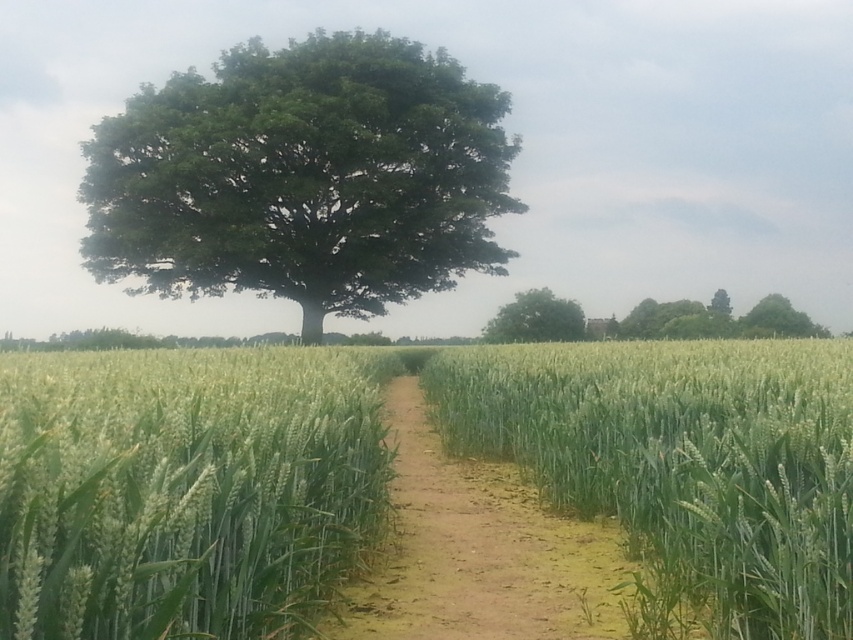
Question: Does green matte wheat at center appear over green leafy tree at center?

Choices:
 (A) yes
 (B) no

Answer: (B)

Question: Considering the real-world distances, which object is farthest from the green leafy tree at center?

Choices:
 (A) green leafy oak tree at center
 (B) green matte wheat at center

Answer: (B)

Question: Which point appears closest to the camera in this image?

Choices:
 (A) (498, 310)
 (B) (426, 426)
 (C) (296, 289)
 (D) (302, 483)

Answer: (D)

Question: Can you confirm if green matte wheat at center is positioned to the left of dull brown dirt path at center?

Choices:
 (A) yes
 (B) no

Answer: (A)

Question: Can you confirm if green matte wheat at center is positioned to the right of green leafy oak tree at center?

Choices:
 (A) no
 (B) yes

Answer: (B)

Question: Which of the following is the closest to the observer?

Choices:
 (A) (608, 428)
 (B) (160, 630)
 (C) (556, 582)

Answer: (B)